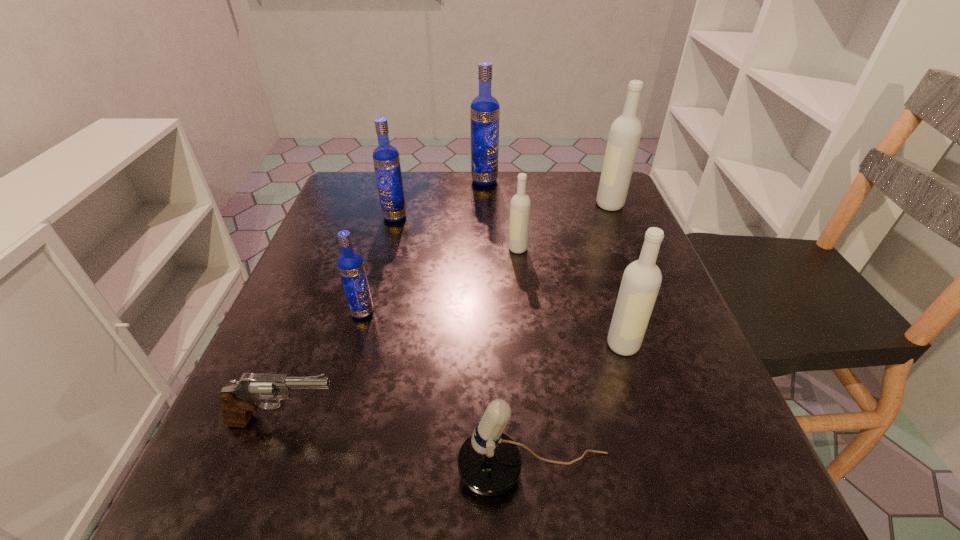
You are a GUI agent. You are given a task and a screenshot of the screen. Output one action in this format:
    pyautogui.click(x=<x>, y=<y>)
    Task: Click on the farthest blue vodka
    The width and height of the screenshot is (960, 540).
    Given the screenshot: What is the action you would take?
    pyautogui.click(x=485, y=111)

Locate an element on the screen. The image size is (960, 540). the third vodka from left to right is located at coordinates (x=485, y=111).

Locate an element on the screen. The image size is (960, 540). the biggest white vodka is located at coordinates (625, 133).

Identify the location of the farthest white vodka. 625,133.

The width and height of the screenshot is (960, 540). In order to click on the second biggest blue vodka in this screenshot , I will do `click(386, 159)`.

Find the location of `the second white vodka from left to right`. the second white vodka from left to right is located at coordinates (641, 281).

Where is `the nearest vodka`? The width and height of the screenshot is (960, 540). the nearest vodka is located at coordinates (641, 281).

Find the location of a particular element. The height and width of the screenshot is (540, 960). the fourth nearest object is located at coordinates (350, 264).

I want to click on the smallest blue vodka, so (x=350, y=264).

Image resolution: width=960 pixels, height=540 pixels. What are the coordinates of `the leftmost white vodka` in the screenshot? It's located at (520, 205).